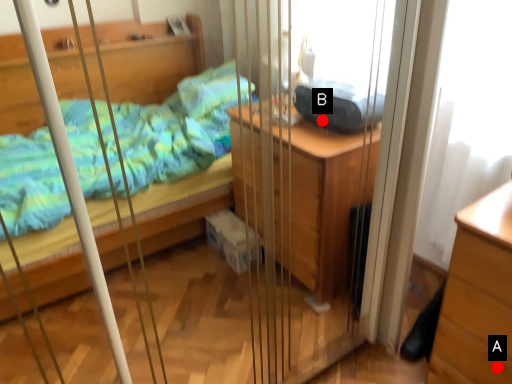
Question: Two points are circled on the image, labeled by A and B beside each circle. Which point is farther from the camera taking this photo?

Choices:
 (A) A is further
 (B) B is further

Answer: (B)